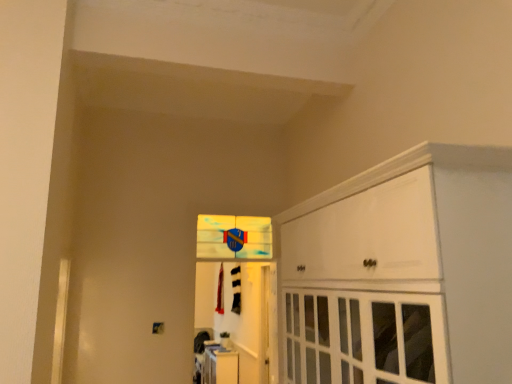
Question: From a real-world perspective, is translucent glass window at center located higher than white glossy door at center?

Choices:
 (A) no
 (B) yes

Answer: (B)

Question: Is translucent glass window at center wider than white glossy door at center?

Choices:
 (A) yes
 (B) no

Answer: (A)

Question: Could you tell me if translucent glass window at center is turned towards white glossy door at center?

Choices:
 (A) yes
 (B) no

Answer: (B)

Question: Is translucent glass window at center smaller than white glossy door at center?

Choices:
 (A) yes
 (B) no

Answer: (B)

Question: Are translucent glass window at center and white glossy door at center making contact?

Choices:
 (A) yes
 (B) no

Answer: (B)

Question: Does translucent glass window at center appear on the right side of white glossy door at center?

Choices:
 (A) yes
 (B) no

Answer: (B)

Question: Does translucent glass window at center contain white glossy cabinet at lower center, which ranks as the second cabinetry in right-to-left order?

Choices:
 (A) no
 (B) yes

Answer: (A)

Question: Can you confirm if translucent glass window at center is positioned to the right of white glossy cabinet at lower center, which ranks as the second cabinetry in right-to-left order?

Choices:
 (A) no
 (B) yes

Answer: (B)

Question: Is there a large distance between translucent glass window at center and white glossy cabinet at lower center, which is counted as the 2th cabinetry, starting from the top?

Choices:
 (A) yes
 (B) no

Answer: (A)

Question: Is translucent glass window at center oriented towards white glossy cabinet at lower center, placed as the 2th cabinetry when sorted from front to back?

Choices:
 (A) no
 (B) yes

Answer: (A)

Question: From the image's perspective, is translucent glass window at center located beneath white glossy cabinet at lower center, placed as the 2th cabinetry when sorted from front to back?

Choices:
 (A) no
 (B) yes

Answer: (A)

Question: Considering the relative positions of translucent glass window at center and white glossy cabinet at lower center, placed as the 2th cabinetry when sorted from front to back, in the image provided, is translucent glass window at center in front of white glossy cabinet at lower center, placed as the 2th cabinetry when sorted from front to back,?

Choices:
 (A) no
 (B) yes

Answer: (B)

Question: Is white glossy door at center bigger than white glossy cabinet at lower center, which is counted as the 2th cabinetry, starting from the top?

Choices:
 (A) no
 (B) yes

Answer: (A)